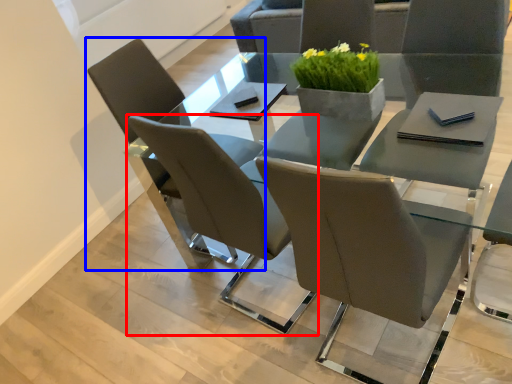
Question: Which of the following is the farthest to the observer, chair (highlighted by a red box) or chair (highlighted by a blue box)?

Choices:
 (A) chair
 (B) chair

Answer: (B)